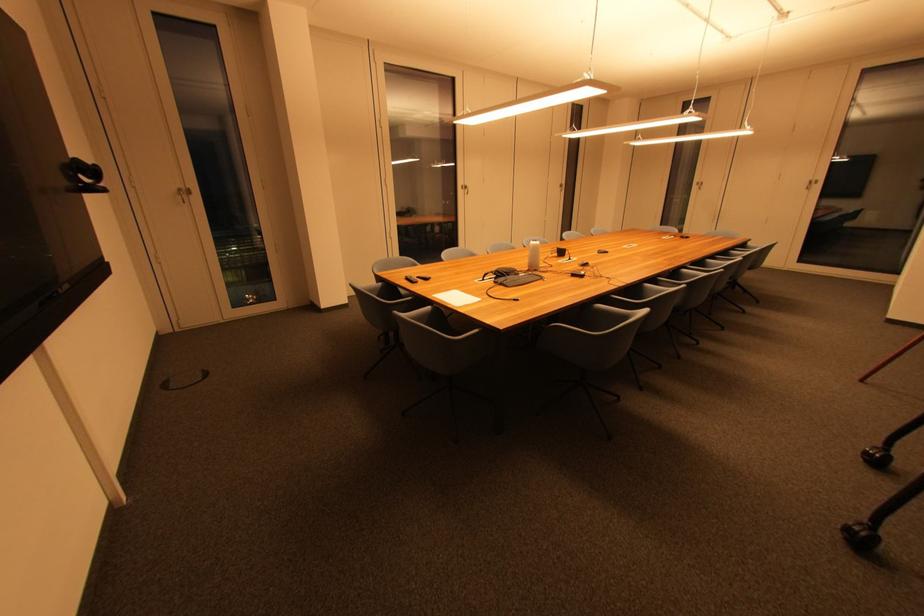
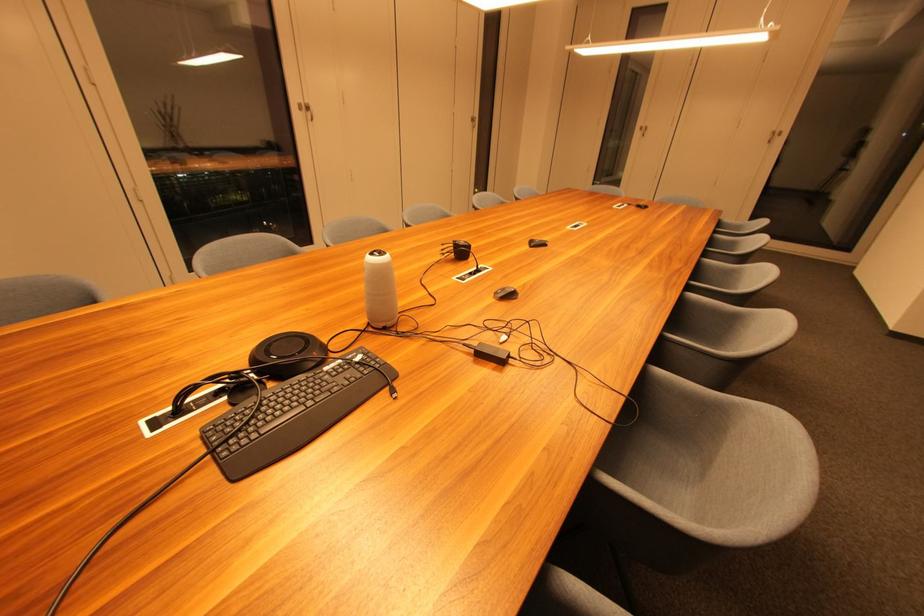
In the second image, find the point that corresponds to point 539,270 in the first image.

(386, 326)